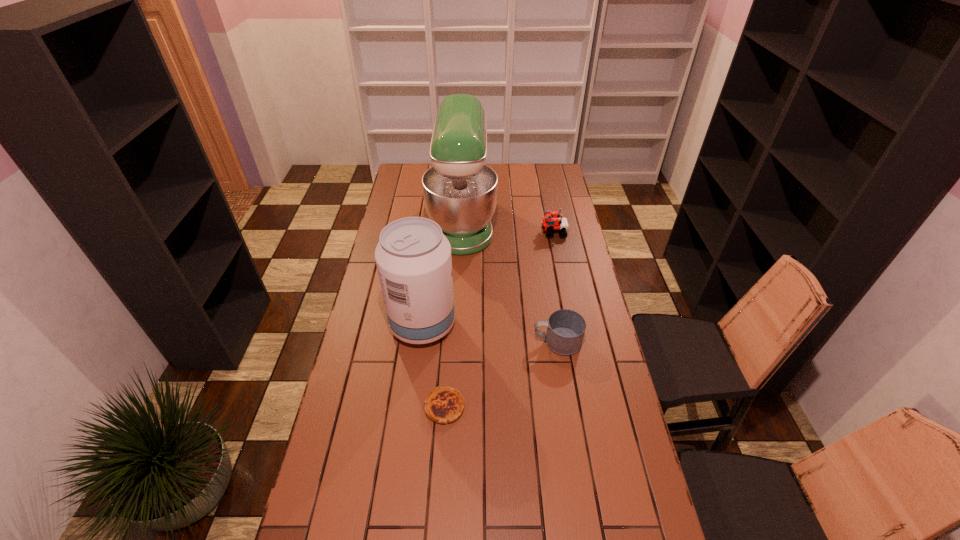
Identify the location of free space that satisfies the following two spatial constraints: 1. on the controls of the tallest object; 2. on the front side of the second tallest object. (458, 325).

The image size is (960, 540). I want to click on vacant area that satisfies the following two spatial constraints: 1. on the front side of the fourth shortest object; 2. on the left side of the nearest object, so click(413, 407).